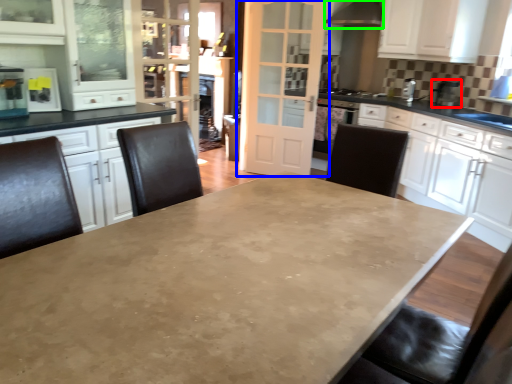
Question: Considering the real-world distances, which object is closest to appliance (highlighted by a red box)? door (highlighted by a blue box) or exhaust hood (highlighted by a green box).

Choices:
 (A) door
 (B) exhaust hood

Answer: (B)